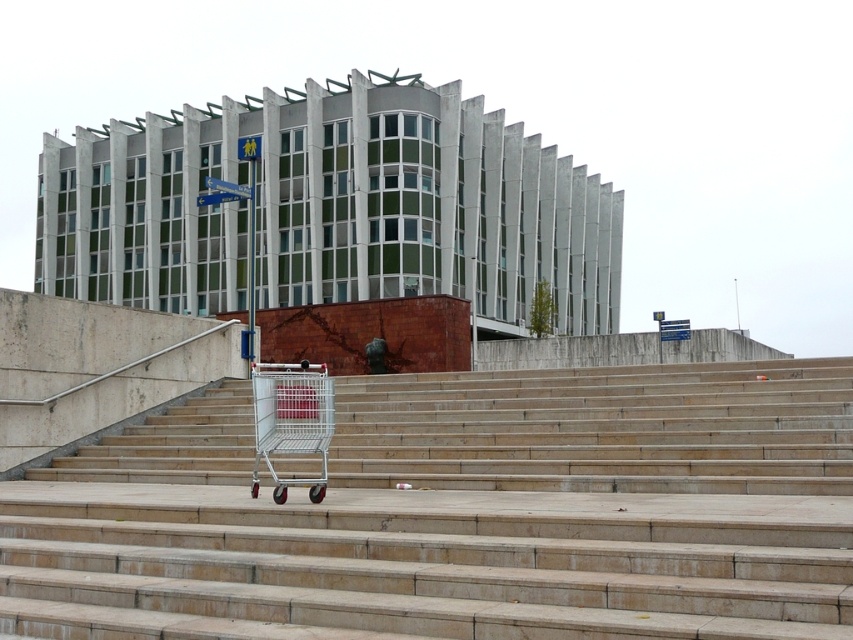
You are standing at the base of the steps in front of the building. You want to take a photo of the point at coordinate [305,557] on the building facade. If your camera is 6.30 meters away from the point, is it within the recommended 6 meters safety distance for capturing clear shots without distortion?

The point at coordinate [305,557] is 6.30 meters away from the camera, which exceeds the recommended 6 meters safety distance. To capture a clear shot without distortion, you should move closer to ensure the distance is within 6 meters.

You are a delivery person trying to move a large package up the smooth concrete stairs at center. You also see a silver metallic shopping cart at lower center nearby. Can you use the shopping cart to carry the package up the stairs?

The smooth concrete stairs at center has a larger size compared to silver metallic shopping cart at lower center. Since the stairs are larger, the shopping cart should be able to fit on the stairs without issue, so yes, you can use the silver metallic shopping cart at lower center to carry the package up the smooth concrete stairs at center.